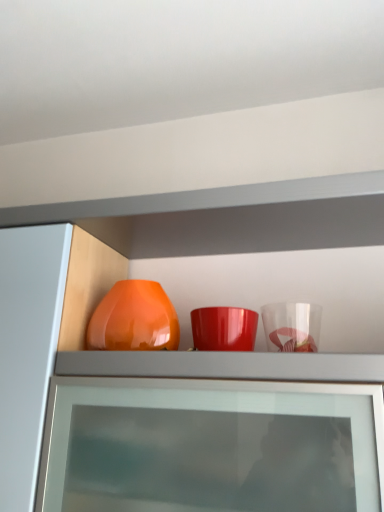
Image resolution: width=384 pixels, height=512 pixels. Describe the element at coordinates (229, 217) in the screenshot. I see `matte orange vase at center` at that location.

Locate an element on the screen. This screenshot has width=384, height=512. matte orange vase at center is located at coordinates (229, 217).

What do you see at coordinates (134, 319) in the screenshot? I see `glossy orange vase at center` at bounding box center [134, 319].

In order to face glossy orange vase at center, should I rotate leftwards or rightwards?

Turn left approximately 6.761 degrees to face it.

What is the approximate width of glossy orange vase at center?

The width of glossy orange vase at center is 24.54 centimeters.

The image size is (384, 512). Identify the location of glossy orange vase at center. (134, 319).

Identify the location of matte orange vase at center. (229, 217).

Which is more to the right, glossy orange vase at center or matte orange vase at center?

matte orange vase at center.

Between glossy orange vase at center and matte orange vase at center, which one is positioned in front?

matte orange vase at center is more forward.

Is point (111, 329) positioned in front of point (371, 341)?

Yes, point (111, 329) is closer to viewer.

From the image's perspective, which is below, glossy orange vase at center or matte orange vase at center?

matte orange vase at center.

From a real-world perspective, is glossy orange vase at center above or below matte orange vase at center?

Clearly, from a real-world perspective, glossy orange vase at center is above matte orange vase at center.

Which of these two, glossy orange vase at center or matte orange vase at center, is wider?

matte orange vase at center is wider.

Who is shorter, glossy orange vase at center or matte orange vase at center?

Standing shorter between the two is glossy orange vase at center.

Considering the sizes of glossy orange vase at center and matte orange vase at center in the image, is glossy orange vase at center bigger or smaller than matte orange vase at center?

In the image, glossy orange vase at center appears to be smaller than matte orange vase at center.

Do you think glossy orange vase at center is within matte orange vase at center, or outside of it?

glossy orange vase at center is located inside matte orange vase at center.

Is glossy orange vase at center not close to matte orange vase at center?

No, glossy orange vase at center is not far from matte orange vase at center.

Consider the image. Is glossy orange vase at center looking in the opposite direction of matte orange vase at center?

Correct, glossy orange vase at center is looking away from matte orange vase at center.

What's the angular difference between glossy orange vase at center and matte orange vase at center's facing directions?

There is a 0.318-degree angle between the facing directions of glossy orange vase at center and matte orange vase at center.

This screenshot has height=512, width=384. What are the coordinates of `cabinetry that appears in front of the glossy orange vase at center` in the screenshot? It's located at (229, 217).

Between matte orange vase at center and glossy orange vase at center, which one appears on the right side from the viewer's perspective?

Positioned to the right is matte orange vase at center.

Is matte orange vase at center further to the viewer compared to glossy orange vase at center?

No.

Considering the positions of points (326, 317) and (96, 317), is point (326, 317) closer to camera compared to point (96, 317)?

No, it is behind (96, 317).

In the scene shown: From the image's perspective, is matte orange vase at center positioned above or below glossy orange vase at center?

matte orange vase at center is situated lower than glossy orange vase at center in the image.

From a real-world perspective, which object rests below the other?

From a 3D spatial view, matte orange vase at center is below.

In terms of width, does matte orange vase at center look wider or thinner when compared to glossy orange vase at center?

In the image, matte orange vase at center appears to be wider than glossy orange vase at center.

From their relative heights in the image, would you say matte orange vase at center is taller or shorter than glossy orange vase at center?

Considering their sizes, matte orange vase at center has more height than glossy orange vase at center.

Looking at the image, does matte orange vase at center seem bigger or smaller compared to glossy orange vase at center?

In the image, matte orange vase at center appears to be larger than glossy orange vase at center.

Is matte orange vase at center inside or outside of glossy orange vase at center?

matte orange vase at center is outside glossy orange vase at center.

Is matte orange vase at center beside glossy orange vase at center?

matte orange vase at center is not next to glossy orange vase at center, and they're not touching.

Is matte orange vase at center oriented away from glossy orange vase at center?

That's right, matte orange vase at center is facing away from glossy orange vase at center.

How many degrees apart are the facing directions of matte orange vase at center and glossy orange vase at center?

They differ by 0.318 degrees in their facing directions.

I want to click on cabinetry below the glossy orange vase at center (from a real-world perspective), so click(229, 217).

Where is `cabinetry located in front of the glossy orange vase at center`? The width and height of the screenshot is (384, 512). cabinetry located in front of the glossy orange vase at center is located at coordinates (229, 217).

You are a GUI agent. You are given a task and a screenshot of the screen. Output one action in this format:
    pyautogui.click(x=<x>, y=<y>)
    Task: Click on the vase behind the matte orange vase at center
    This screenshot has width=384, height=512.
    Given the screenshot: What is the action you would take?
    pyautogui.click(x=134, y=319)